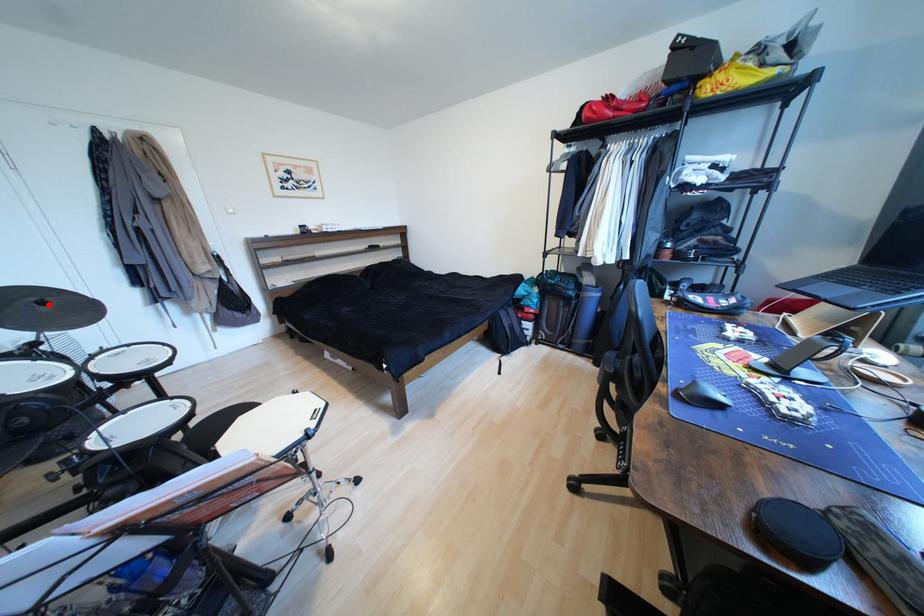
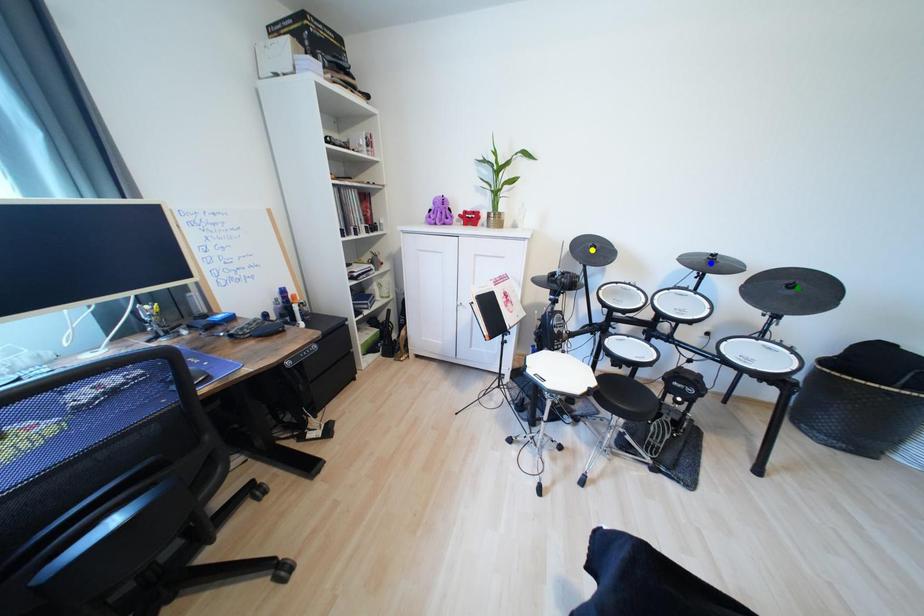
Question: I am providing you with two images of the same scene from different viewpoints. A red point is marked on the first image. You are given multiple points on the second image. Which mark in image 2 goes with the point in image 1?

Choices:
 (A) green point
 (B) yellow point
 (C) blue point

Answer: (A)